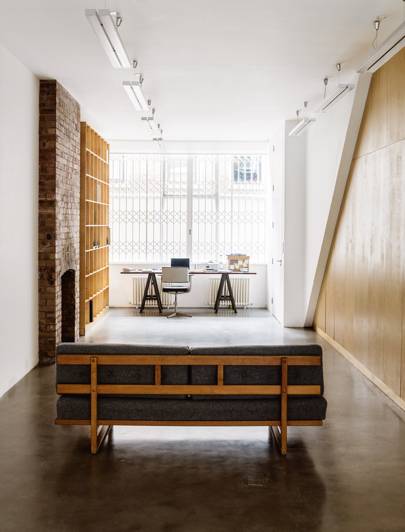
The height and width of the screenshot is (532, 405). Identify the location of radiators. (136, 288), (248, 284).